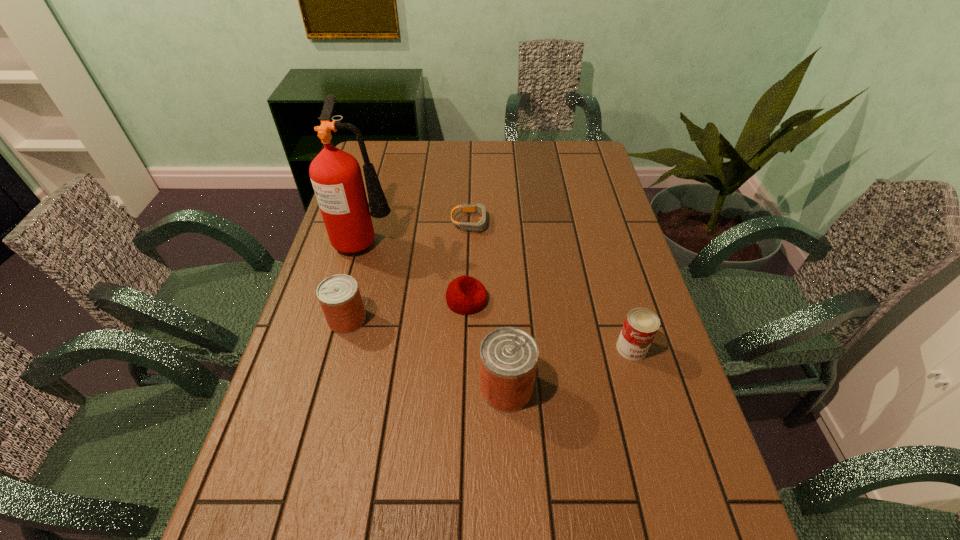
This screenshot has height=540, width=960. Identify the location of vacant space located 0.160m on the front and back of the shortest object. (541, 222).

Where is `free region located at the nozzle of the fire extinguisher`? free region located at the nozzle of the fire extinguisher is located at coordinates (526, 239).

The width and height of the screenshot is (960, 540). Find the location of `free spot located 0.080m on the front label of the second farthest can`. free spot located 0.080m on the front label of the second farthest can is located at coordinates (644, 391).

You are a GUI agent. You are given a task and a screenshot of the screen. Output one action in this format:
    pyautogui.click(x=<x>, y=<y>)
    Task: Click on the vacant region located on the seat area of the fifth tallest object
    The height and width of the screenshot is (540, 960).
    Given the screenshot: What is the action you would take?
    pyautogui.click(x=612, y=300)

Identify the location of can located at the left edge. (339, 296).

Locate an element on the screen. This screenshot has width=960, height=540. fire extinguisher at the left edge is located at coordinates (336, 176).

Where is `object that is at the right edge`? The height and width of the screenshot is (540, 960). object that is at the right edge is located at coordinates (641, 324).

I want to click on free region at the far edge of the desktop, so click(x=483, y=165).

Locate an element on the screen. The width and height of the screenshot is (960, 540). vacant space at the near edge of the desktop is located at coordinates (399, 499).

In the image, there is a desktop. At what (x,y) coordinates should I click in order to perform the action: click on vacant space at the left edge. Please return your answer as a coordinate pair (x, y). Image resolution: width=960 pixels, height=540 pixels. Looking at the image, I should click on 345,265.